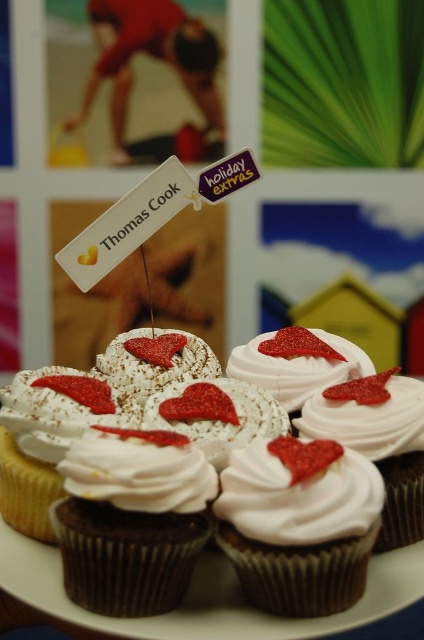
Is white matte cupcake at center wider than white cream cupcake at center?

Correct, the width of white matte cupcake at center exceeds that of white cream cupcake at center.

Can you confirm if white matte cupcake at center is shorter than white cream cupcake at center?

Correct, white matte cupcake at center is not as tall as white cream cupcake at center.

This screenshot has height=640, width=424. What are the coordinates of `white matte cupcake at center` in the screenshot? It's located at (131, 518).

Where is `white matte cupcake at center`? The width and height of the screenshot is (424, 640). white matte cupcake at center is located at coordinates (131, 518).

Does white fluffy frosting at center have a lesser height compared to white cream cupcake at center?

Yes, white fluffy frosting at center is shorter than white cream cupcake at center.

Is point (237, 449) farther from viewer compared to point (357, 426)?

No, (237, 449) is in front of (357, 426).

Is point (337, 476) positioned in front of point (368, 416)?

Yes, point (337, 476) is in front of point (368, 416).

The width and height of the screenshot is (424, 640). I want to click on white fluffy frosting at center, so click(x=298, y=492).

How far apart are white frosted cupcake with red glitter heart at center and white glossy frosting at center?

white frosted cupcake with red glitter heart at center and white glossy frosting at center are 5.14 inches apart from each other.

Can you confirm if white frosted cupcake with red glitter heart at center is wider than white glossy frosting at center?

Correct, the width of white frosted cupcake with red glitter heart at center exceeds that of white glossy frosting at center.

Describe the element at coordinates (134, 413) in the screenshot. The width and height of the screenshot is (424, 640). I see `white frosted cupcake with red glitter heart at center` at that location.

Identify the location of white frosted cupcake with red glitter heart at center. The image size is (424, 640). (134, 413).